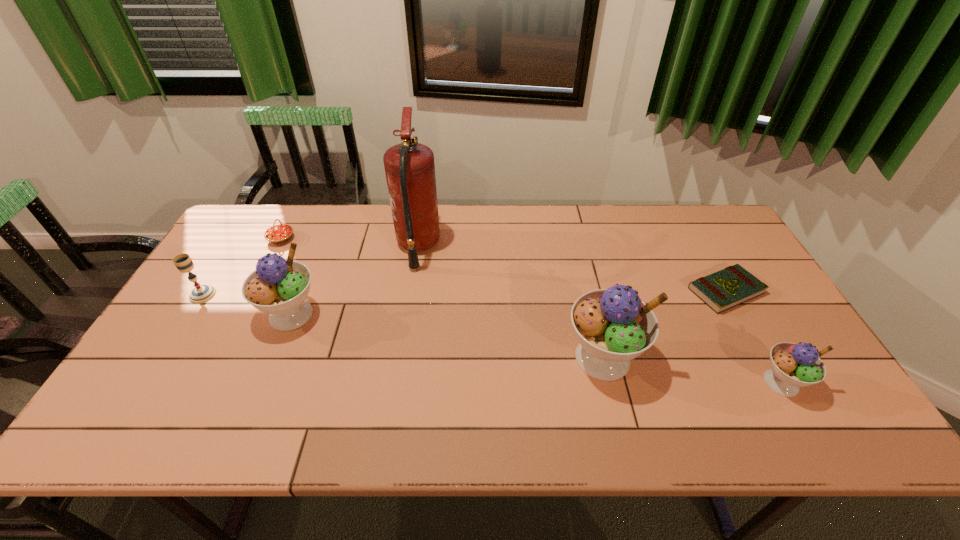
Find the location of a particular element. Image resolution: width=960 pixels, height=540 pixels. free point located 0.250m on the back of the fifth shortest object is located at coordinates (323, 238).

I want to click on free point located 0.340m on the right of the fifth object from left to right, so click(777, 358).

Locate an element on the screen. The width and height of the screenshot is (960, 540). free region located on the left of the shortest icecream is located at coordinates (704, 382).

The width and height of the screenshot is (960, 540). I want to click on blank space located 0.240m on the front of the strawberry, so click(249, 303).

The width and height of the screenshot is (960, 540). Identify the location of free space located 0.220m at the front of the fourth object from left to right where the nozzle is aimed. (508, 247).

You are a GUI agent. You are given a task and a screenshot of the screen. Output one action in this format:
    pyautogui.click(x=<x>, y=<y>)
    Task: Click on the vacant area situated 0.160m on the back of the book
    This screenshot has height=540, width=960.
    Given the screenshot: What is the action you would take?
    pyautogui.click(x=696, y=237)

Locate an element on the screen. This screenshot has height=540, width=960. free space located on the right of the chalice is located at coordinates (330, 294).

This screenshot has width=960, height=540. I want to click on strawberry that is at the far edge, so click(x=277, y=234).

Where is `fire extinguisher that is at the far edge`? fire extinguisher that is at the far edge is located at coordinates (409, 167).

This screenshot has height=540, width=960. In order to click on strawberry present at the left edge in this screenshot , I will do `click(277, 234)`.